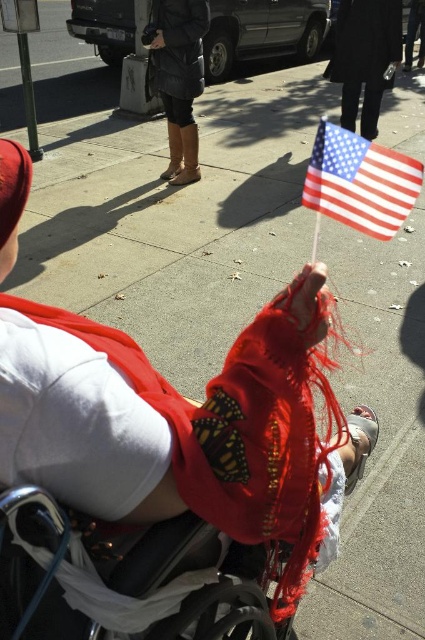
Where is `black plastic wheelchair at center`? The width and height of the screenshot is (425, 640). black plastic wheelchair at center is located at coordinates (125, 577).

Is point (33, 630) positioned in front of point (387, 177)?

Yes, it is.

The height and width of the screenshot is (640, 425). What do you see at coordinates (125, 577) in the screenshot?
I see `black plastic wheelchair at center` at bounding box center [125, 577].

Find the location of a particular element. Image resolution: width=425 pixels, height=640 pixels. black plastic wheelchair at center is located at coordinates (125, 577).

How distant is american flag at upper right from leather boots at center?

4.16 meters

Which is behind, point (411, 164) or point (167, 74)?

Point (167, 74)

Which is behind, point (365, 208) or point (192, 54)?

Point (192, 54)

This screenshot has height=640, width=425. In order to click on american flag at upper right in this screenshot , I will do `click(359, 182)`.

Based on the photo, does black plastic wheelchair at center appear on the right side of leather boots at center?

Yes, black plastic wheelchair at center is to the right of leather boots at center.

Is black plastic wheelchair at center below leather boots at center?

Yes, black plastic wheelchair at center is below leather boots at center.

Is point (11, 595) less distant than point (178, 26)?

Yes, point (11, 595) is closer to viewer.

Identify the location of black plastic wheelchair at center. (125, 577).